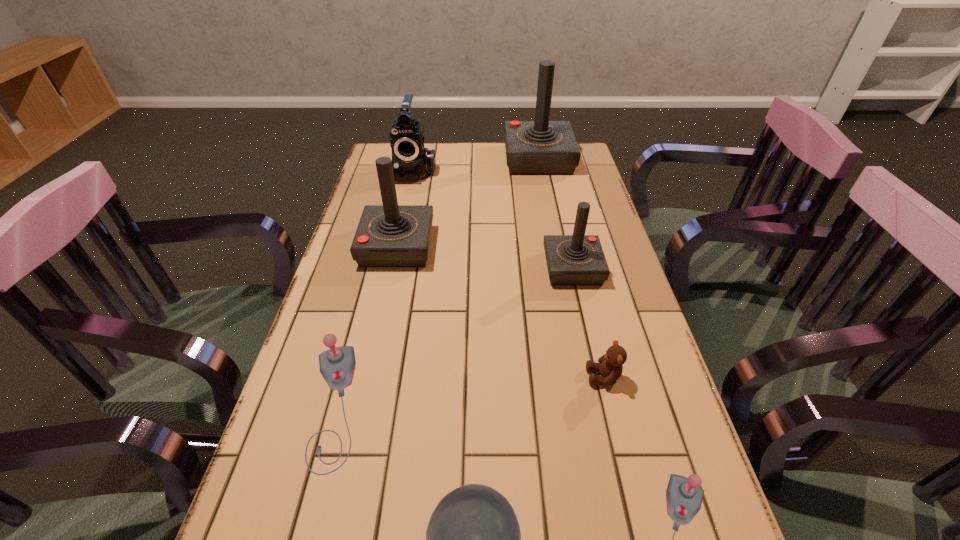
This screenshot has width=960, height=540. In order to click on vacant area between the second tallest joystick and the bigger gray joystick in this screenshot , I will do `click(365, 327)`.

Find the location of a particular element. The image size is (960, 540). free area in between the second tallest joystick and the fourth tallest joystick is located at coordinates (365, 327).

Locate an element on the screen. vacant space that is in between the camcorder and the left gray joystick is located at coordinates (372, 288).

Where is `free space between the third shortest joystick and the biggest red joystick`? This screenshot has height=540, width=960. free space between the third shortest joystick and the biggest red joystick is located at coordinates (556, 214).

At what (x,y) coordinates should I click in order to perform the action: click on free space between the second shortest joystick and the brown teddy bear. Please return your answer as a coordinate pair (x, y). The image size is (960, 540). Looking at the image, I should click on (468, 392).

This screenshot has width=960, height=540. Find the location of `free space between the camcorder and the farther gray joystick`. free space between the camcorder and the farther gray joystick is located at coordinates (372, 288).

At what (x,y) coordinates should I click in order to perform the action: click on object that is the third nearest to the second shortest joystick. Please return your answer as a coordinate pair (x, y). The height and width of the screenshot is (540, 960). Looking at the image, I should click on (684, 496).

Locate an element on the screen. the fourth closest object to the leftmost red joystick is located at coordinates (541, 147).

Where is `joystick that is the fourth closest one to the farthest joystick`? The height and width of the screenshot is (540, 960). joystick that is the fourth closest one to the farthest joystick is located at coordinates (684, 496).

This screenshot has height=540, width=960. I want to click on the third closest joystick relative to the second nearest joystick, so click(578, 259).